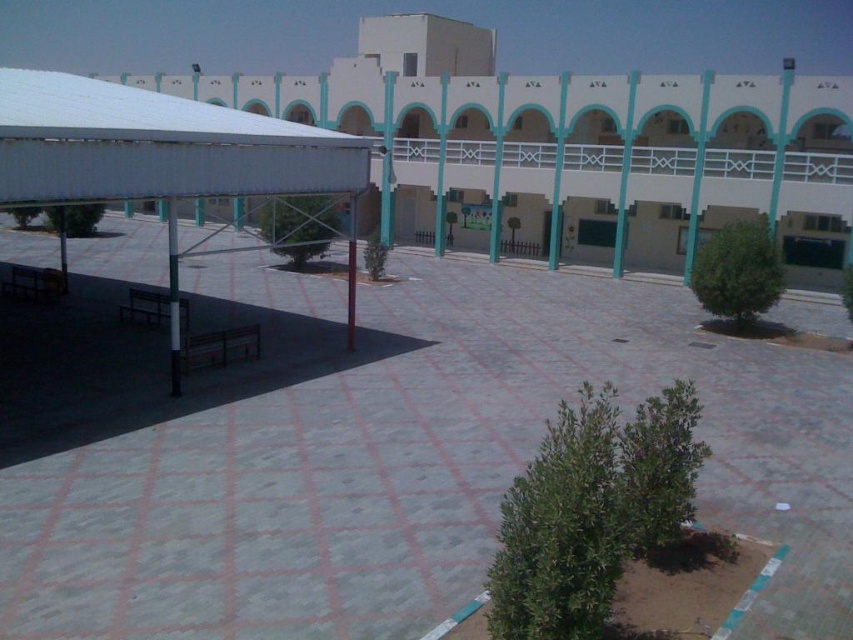
You are a student trying to find shade during recess. You see the gray concrete courtyard at center and the white matte canopy at upper left. Which location is shaded by the canopy?

The gray concrete courtyard at center is shaded by the white matte canopy at upper left because it is located below it.

You are standing at the entrance of the school and want to reach the gray concrete courtyard at center. Which direction should you walk to get there?

The gray concrete courtyard at center is located at point (413,461), so you should walk towards the center of the image to reach it.